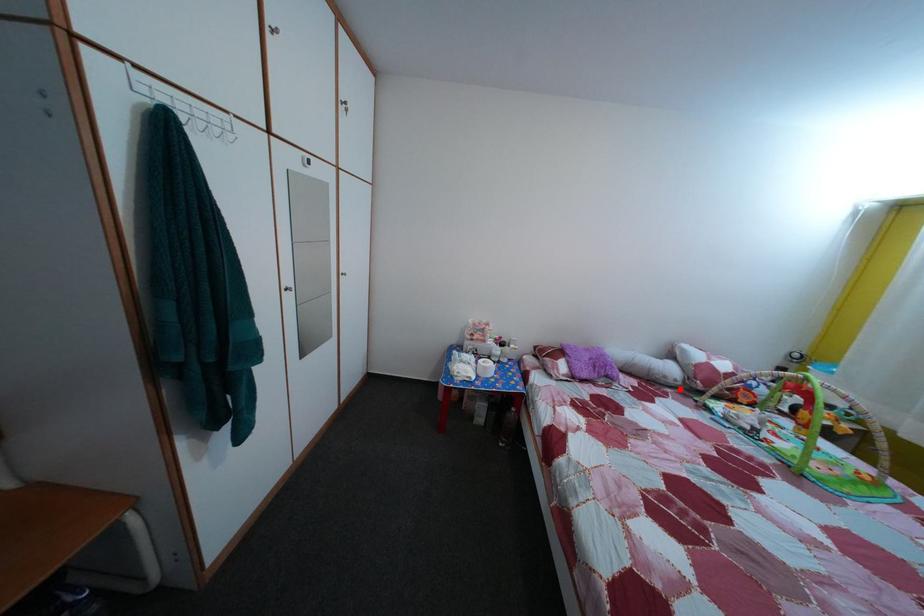
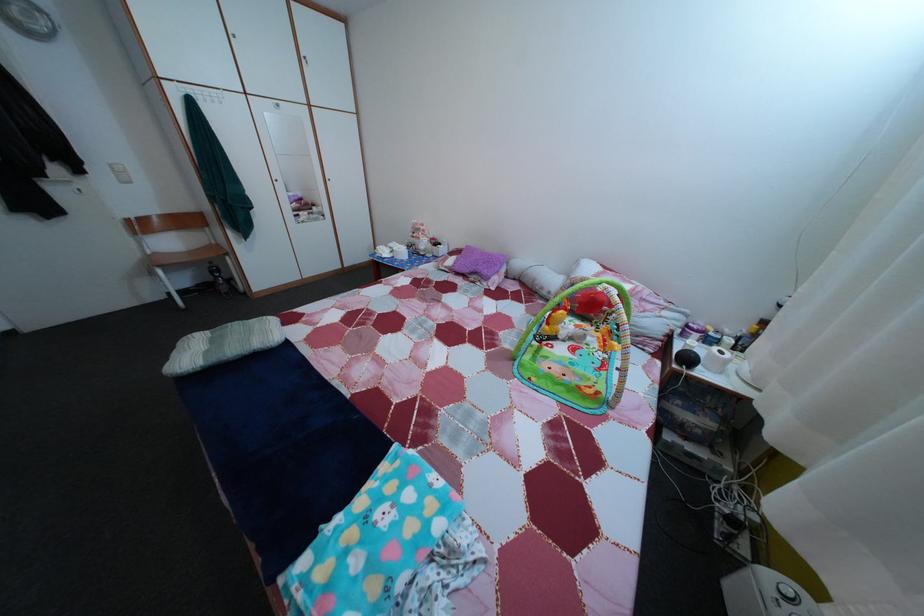
Question: I am providing you with two images of the same scene from different viewpoints. A red point is marked on the first image. Can you still see the location of the red point in image 2?

Choices:
 (A) Yes
 (B) No

Answer: (A)